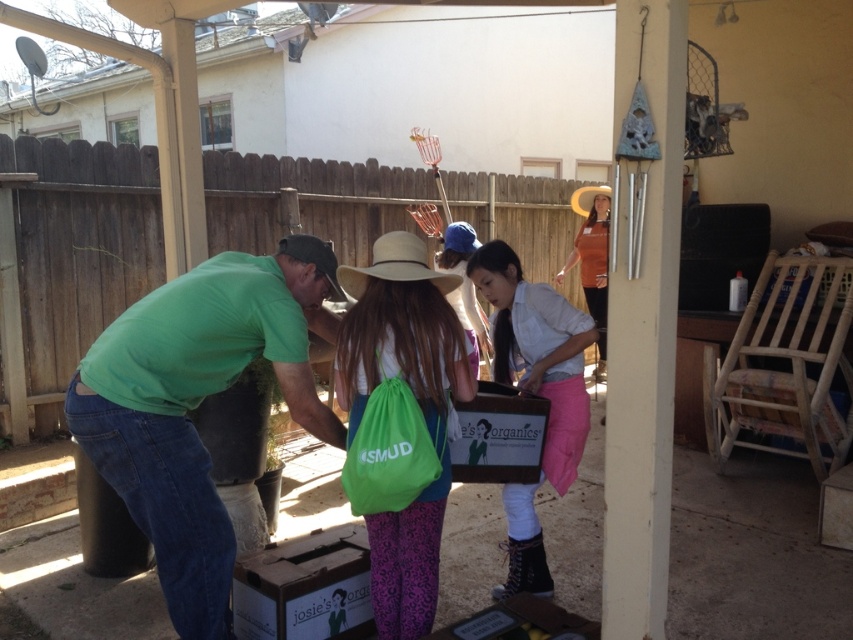
Question: Does white matte shirt at center have a smaller size compared to beige straw hat at center?

Choices:
 (A) no
 (B) yes

Answer: (A)

Question: Which object is farther from the camera taking this photo?

Choices:
 (A) beige straw hat at center
 (B) green fabric bag at center
 (C) light brown straw cowboy hat at upper center
 (D) white matte shirt at center

Answer: (C)

Question: Estimate the real-world distances between objects in this image. Which object is farther from the green matte shirt at center?

Choices:
 (A) green fabric bag at center
 (B) white matte shirt at center
 (C) beige straw hat at center
 (D) light brown straw cowboy hat at upper center

Answer: (D)

Question: Does green fabric bag at center appear under white matte shirt at center?

Choices:
 (A) no
 (B) yes

Answer: (B)

Question: Which point is closer to the camera?

Choices:
 (A) (296, 381)
 (B) (416, 554)
 (C) (572, 205)

Answer: (A)

Question: Can you confirm if white matte shirt at center is smaller than light brown straw cowboy hat at upper center?

Choices:
 (A) yes
 (B) no

Answer: (B)